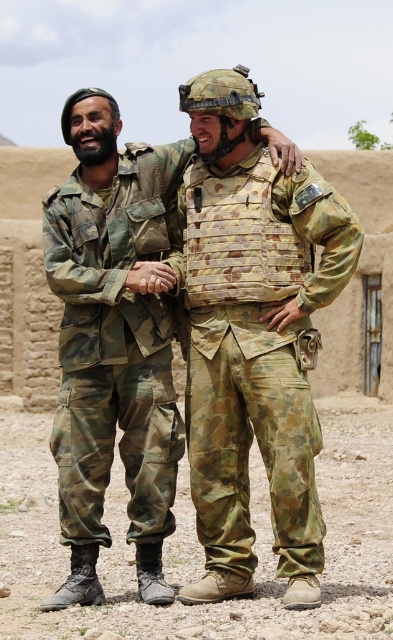
You are a photographer positioned at the origin point of the image coordinate system. You need to capture a photo of the camouflage uniform at center. What are the coordinates where you should aim your camera?

The camouflage uniform at center is located at point (112, 342), so you should aim your camera at those coordinates to capture it.

You are a photographer trying to capture a clear photo of both the camouflage uniform at center and the camouflage fabric vest at center. Since both are in the same area, which one is covering the other?

The camouflage uniform at center is positioned over the camouflage fabric vest at center, so it is covering it.